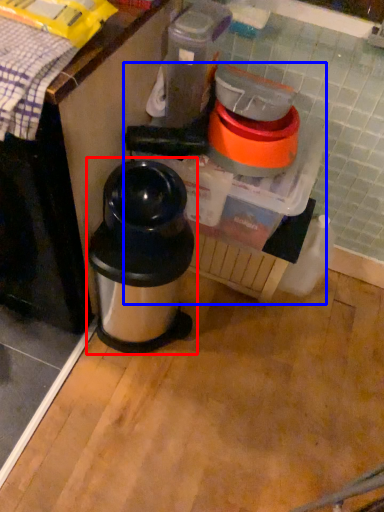
Question: Which point is closer to the camera, waste container (highlighted by a red box) or blender (highlighted by a blue box)?

Choices:
 (A) waste container
 (B) blender

Answer: (A)